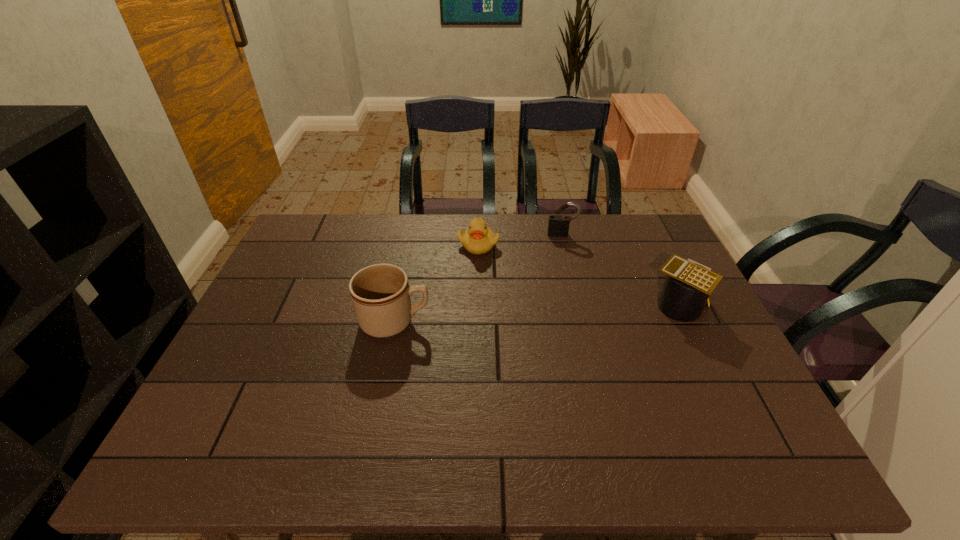
Find the location of `vacant space situated with the keyhole on the front of the third object from left to right`. vacant space situated with the keyhole on the front of the third object from left to right is located at coordinates point(564,289).

In order to click on free space located 0.050m with the keyhole on the front of the third object from left to right in this screenshot , I will do `click(562, 246)`.

Locate an element on the screen. Image resolution: width=960 pixels, height=540 pixels. vacant space positioned 0.270m with the keyhole on the front of the third object from left to right is located at coordinates (564, 292).

Where is `duckling located at the far edge`? The height and width of the screenshot is (540, 960). duckling located at the far edge is located at coordinates (478, 239).

At what (x,y) coordinates should I click in order to perform the action: click on padlock present at the far edge. Please return your answer as a coordinate pair (x, y). This screenshot has height=540, width=960. Looking at the image, I should click on (558, 226).

Find the location of a particular element. object located in the right edge section of the desktop is located at coordinates (687, 287).

What are the coordinates of `free spot at the far edge of the desktop` in the screenshot? It's located at (609, 248).

This screenshot has height=540, width=960. In the image, there is a desktop. Find the location of `vacant space at the near edge`. vacant space at the near edge is located at coordinates (449, 394).

Image resolution: width=960 pixels, height=540 pixels. In order to click on vacant space at the left edge of the desktop in this screenshot , I will do `click(294, 271)`.

At what (x,y) coordinates should I click in order to perform the action: click on free space at the far left corner of the desktop. Please return your answer as a coordinate pair (x, y). The height and width of the screenshot is (540, 960). Looking at the image, I should click on (325, 226).